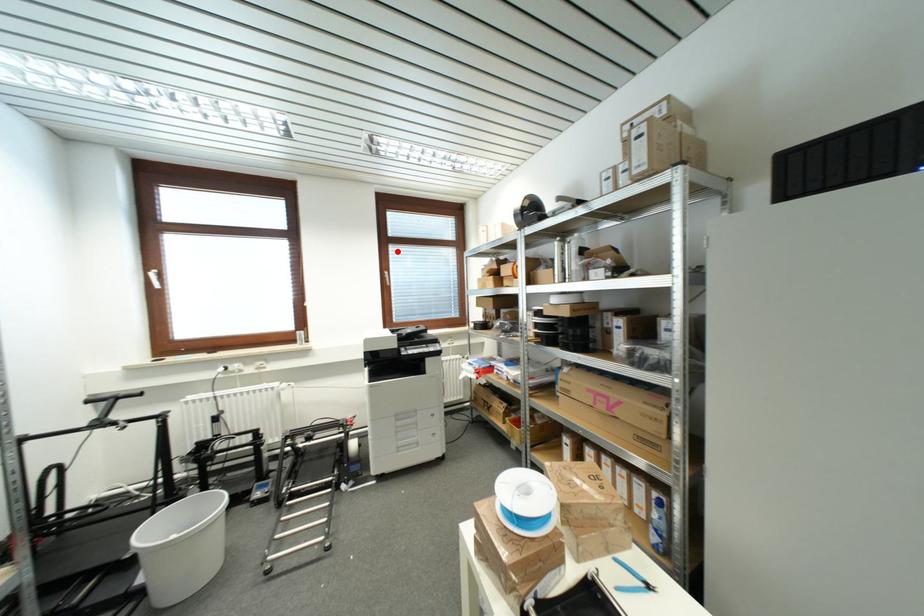
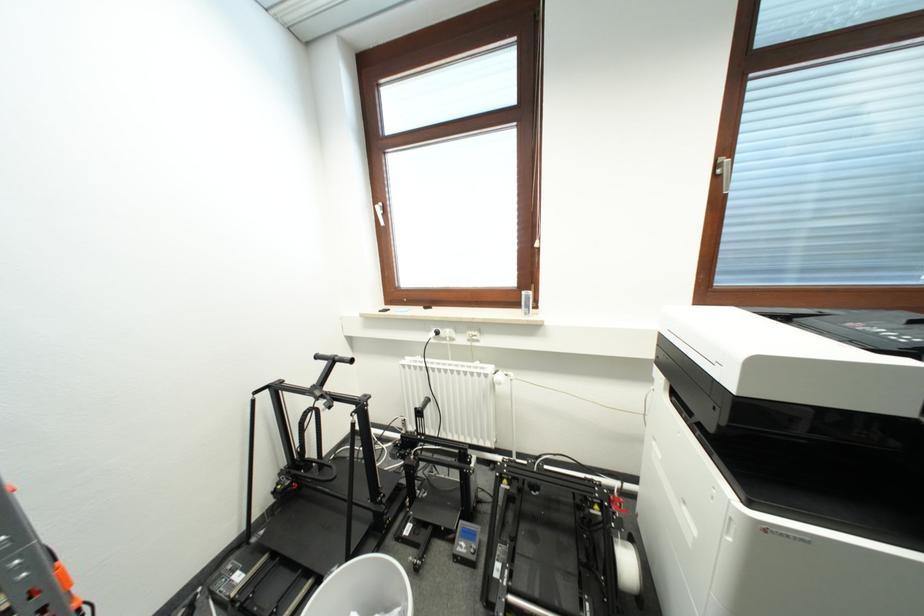
Question: I am providing you with two images of the same scene from different viewpoints. Image1 has a red point marked. In image2, the corresponding 3D location appears at what relative position? Reply with the corresponding letter.

Choices:
 (A) Closer
 (B) Farther

Answer: (B)